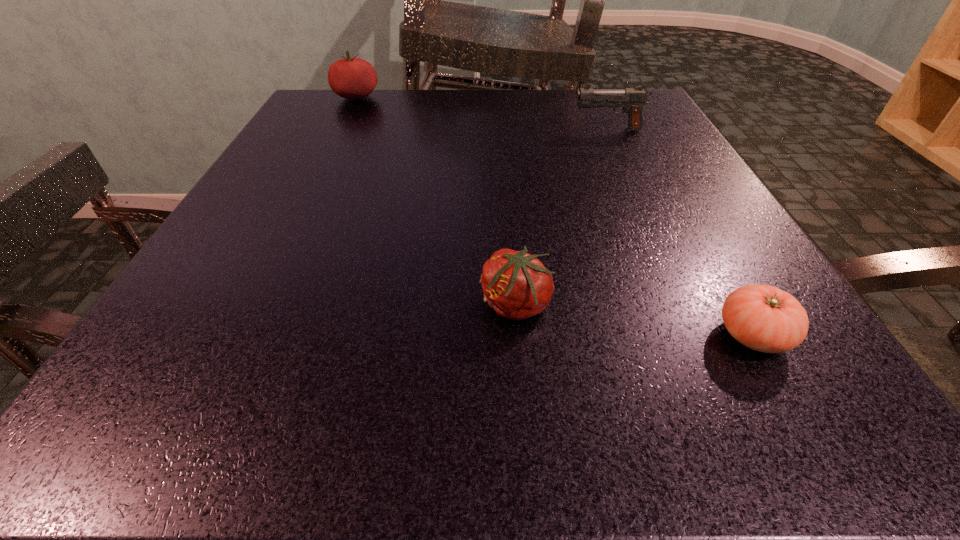
Locate an element on the screen. the farthest tomato is located at coordinates (352, 78).

Image resolution: width=960 pixels, height=540 pixels. Find the location of `the leftmost tomato`. the leftmost tomato is located at coordinates (352, 78).

The height and width of the screenshot is (540, 960). I want to click on gun, so click(x=633, y=99).

Image resolution: width=960 pixels, height=540 pixels. I want to click on the second tomato from right to left, so click(515, 284).

Locate an element on the screen. the rightmost tomato is located at coordinates (764, 318).

I want to click on vacant space located 0.130m on the right of the leftmost object, so click(435, 98).

Find the location of `vacant space located 0.390m in the direction the gun is aimed`. vacant space located 0.390m in the direction the gun is aimed is located at coordinates (385, 130).

Find the location of `free location located 0.310m in the direction the gun is aimed`. free location located 0.310m in the direction the gun is aimed is located at coordinates (423, 130).

Find the location of `free spot located in the direction the gun is aimed`. free spot located in the direction the gun is aimed is located at coordinates (399, 130).

I want to click on free location located on the back of the second tomato from left to right, so click(x=503, y=147).